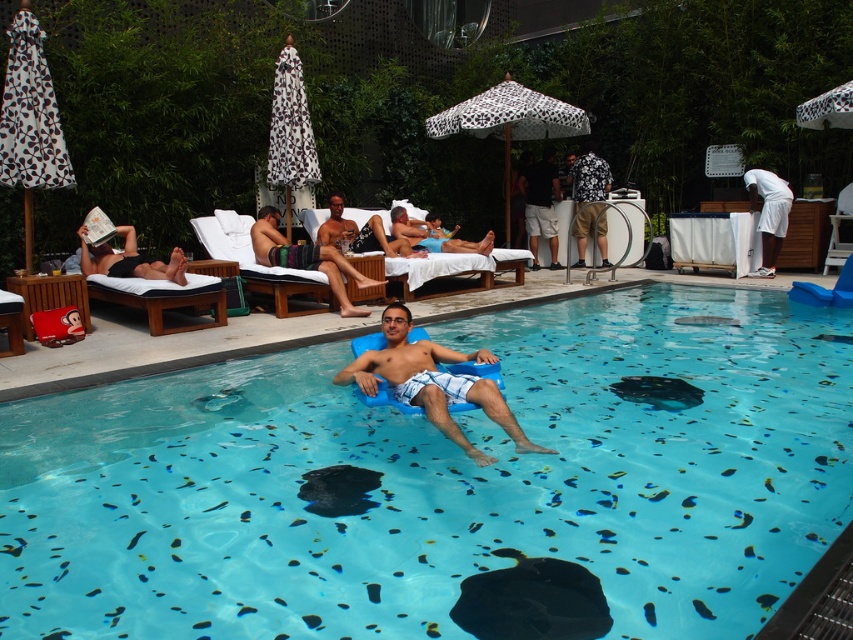
Between point (56, 124) and point (764, 262), which one is positioned behind?

Positioned behind is point (764, 262).

In the scene shown: Can you confirm if black and white printed umbrella at upper left is positioned below white cloth at right?

Incorrect, black and white printed umbrella at upper left is not positioned below white cloth at right.

Describe the element at coordinates (30, 122) in the screenshot. I see `black and white printed umbrella at upper left` at that location.

Find the location of a particular element. This screenshot has height=640, width=853. black and white printed umbrella at upper left is located at coordinates (30, 122).

Between point (502, 624) and point (392, 342), which one is positioned behind?

Positioned behind is point (392, 342).

Between black rubber stingray at center and blue foam float at center, which one has more height?

blue foam float at center is taller.

Measure the distance between point [457,618] and camera.

They are 7.82 feet apart.

The height and width of the screenshot is (640, 853). What are the coordinates of `black rubber stingray at center` in the screenshot? It's located at (532, 600).

Is black rubber stingray at center bigger than black fabric towel at upper left?

No.

Does black rubber stingray at center have a lesser height compared to black fabric towel at upper left?

Yes, black rubber stingray at center is shorter than black fabric towel at upper left.

Is point (575, 584) behind point (80, 268)?

No, (575, 584) is closer to viewer.

Locate an element on the screen. This screenshot has height=640, width=853. black rubber stingray at center is located at coordinates (532, 600).